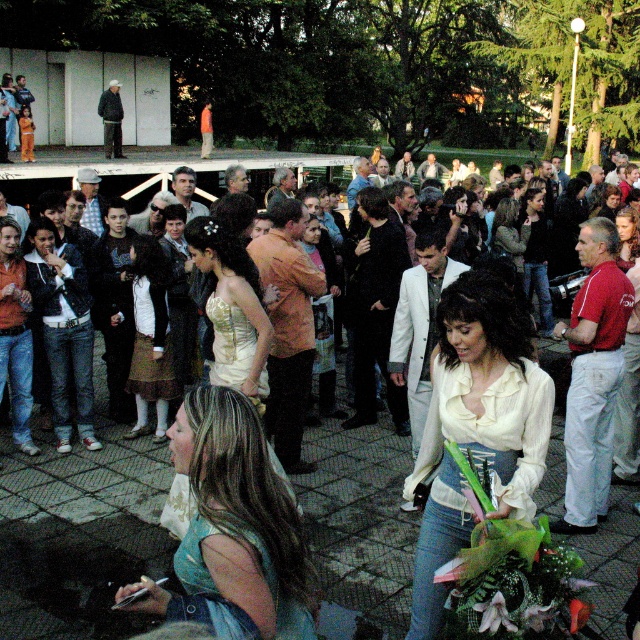
You are a photographer at the event and want to capture both the white satin blouse at center and the matte gold dress at center in a single shot. Which clothing item will appear larger in the photo?

The white satin blouse at center will appear larger in the photo because it is much taller than the matte gold dress at center.

You are an event planner trying to place a banner in the center of the crowd. The banner is 1 meter wide and needs to be placed at the exact center of the crowd. Given the white satin blouse at center is located at coordinates 0.664, 0.745, can you determine if the banner will fit without overlapping any part of the crowd?

The white satin blouse at center is located at coordinates (476,424). Since the banner needs to be placed at the exact center of the crowd, and the blouse is already at the center, placing the banner there would overlap the blouse. Therefore, the banner cannot be placed without overlapping.